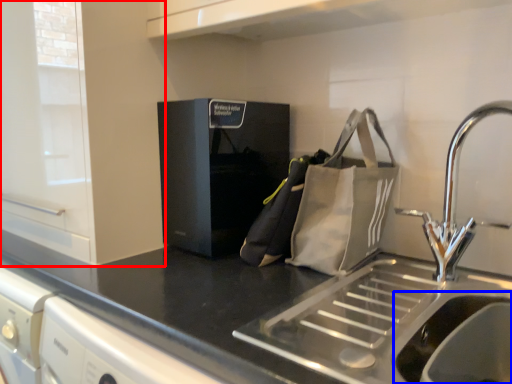
Question: Which of the following is the closest to the observer, cabinetry (highlighted by a red box) or sink (highlighted by a blue box)?

Choices:
 (A) cabinetry
 (B) sink

Answer: (B)